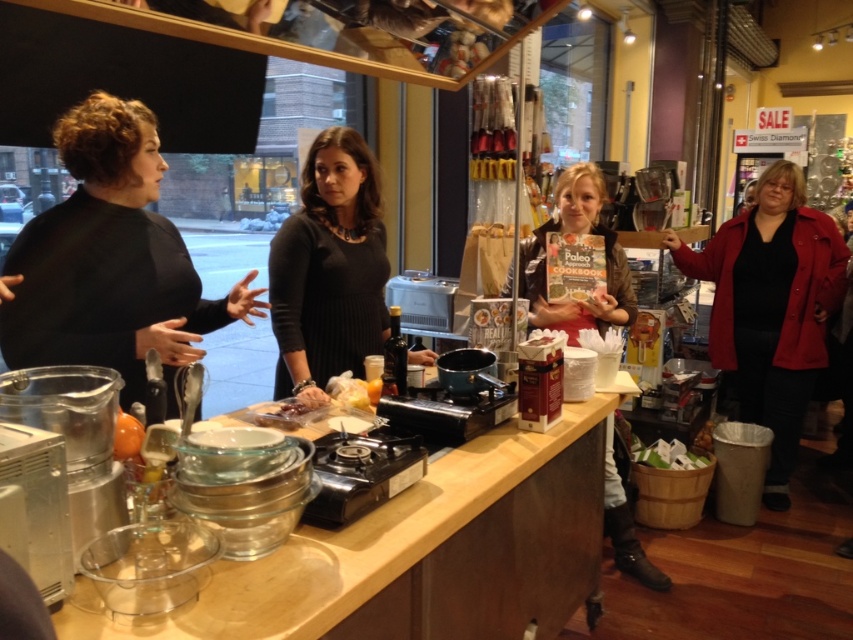
You are a participant in the cooking class and want to reach for the black matte sweater at left. Considering your arm length is 0.8 meters, can you grab it without moving your feet?

The black matte sweater at left is 1.32 meters away from the viewer. Since your arm length is 0.8 meters, you cannot reach it without moving your feet because the distance is greater than your arm length.

You are a participant in the cooking class and need to place the black matte sweater at left and the translucent glass bottle at center into a storage box. The box can only fit items smaller than the sweater. Will both items fit?

The black matte sweater at left is larger in size than the translucent glass bottle at center. Since the box can only fit items smaller than the sweater, the translucent glass bottle at center will fit, but the sweater itself will not fit into the box.

You are a fashion designer observing a cooking demonstration. You notice the black matte sweater at left and the brown leather jacket at center. Which article of clothing is shorter in height?

The black matte sweater at left has a lesser height compared to the brown leather jacket at center, so the black matte sweater at left is shorter in height.